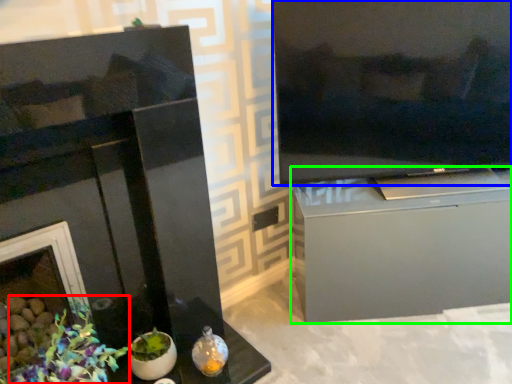
Question: Estimate the real-world distances between objects in this image. Which object is farther from floral arrangement (highlighted by a red box), television (highlighted by a blue box) or cabinetry (highlighted by a green box)?

Choices:
 (A) television
 (B) cabinetry

Answer: (A)